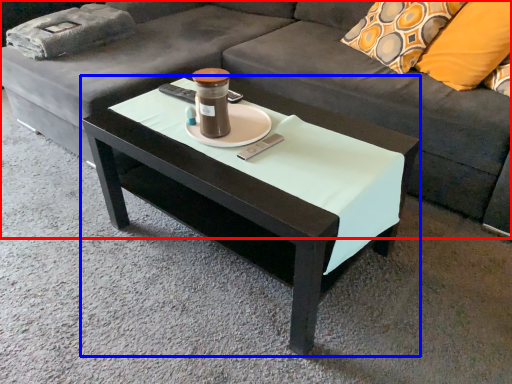
Question: Which object appears farthest to the camera in this image, studio couch (highlighted by a red box) or coffee table (highlighted by a blue box)?

Choices:
 (A) studio couch
 (B) coffee table

Answer: (B)